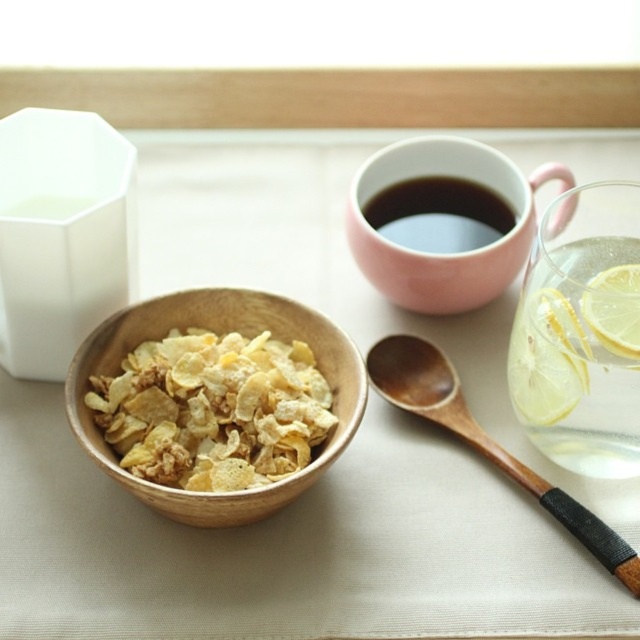
Question: Which object is positioned closest to the wooden spoon at lower right?

Choices:
 (A) yellow translucent lemon at right
 (B) translucent glass lemon at right
 (C) golden textured flakes at center
 (D) matte pink cup at upper center

Answer: (B)

Question: Which point is farther to the camera?

Choices:
 (A) golden textured flakes at center
 (B) translucent glass lemon at right

Answer: (A)

Question: Which point is farther from the camera taking this photo?

Choices:
 (A) (220, 490)
 (B) (396, 186)

Answer: (B)

Question: Where is golden textured flakes at center located in relation to yellow translucent lemon at right in the image?

Choices:
 (A) below
 (B) above

Answer: (A)

Question: Is matte pink cup at upper center in front of yellow translucent lemon at right?

Choices:
 (A) yes
 (B) no

Answer: (B)

Question: Can you confirm if wooden spoon at lower right is thinner than matte pink cup at upper center?

Choices:
 (A) yes
 (B) no

Answer: (B)